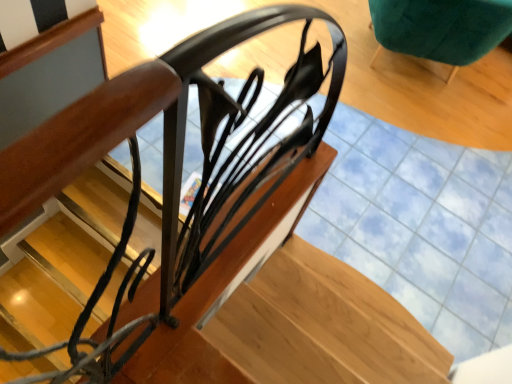
Question: Is glossy metal stairs at center bigger or smaller than velvet green armchair at upper right?

Choices:
 (A) small
 (B) big

Answer: (B)

Question: Choose the correct answer: Is glossy metal stairs at center inside velvet green armchair at upper right or outside it?

Choices:
 (A) outside
 (B) inside

Answer: (A)

Question: From the image's perspective, is glossy metal stairs at center positioned above or below velvet green armchair at upper right?

Choices:
 (A) above
 (B) below

Answer: (B)

Question: Would you say velvet green armchair at upper right is to the left or to the right of glossy metal stairs at center in the picture?

Choices:
 (A) right
 (B) left

Answer: (A)

Question: Is velvet green armchair at upper right spatially inside glossy metal stairs at center, or outside of it?

Choices:
 (A) inside
 (B) outside

Answer: (B)

Question: From the image's perspective, relative to glossy metal stairs at center, is velvet green armchair at upper right above or below?

Choices:
 (A) below
 (B) above

Answer: (B)

Question: From their relative heights in the image, would you say velvet green armchair at upper right is taller or shorter than glossy metal stairs at center?

Choices:
 (A) short
 (B) tall

Answer: (B)